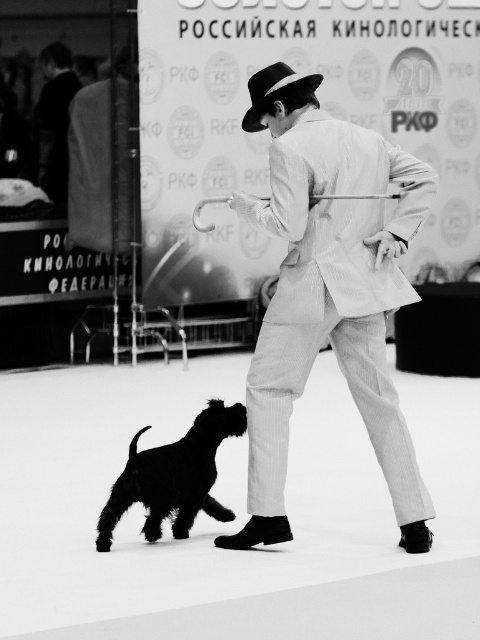
You are a photographer at the event and need to capture a closeup of the white pinstripe suit at center and the black fur dog at lower left. Which subject should you focus on first if you want to ensure both are in sharp focus?

The white pinstripe suit at center is bigger than the black fur dog at lower left, so you should focus on the white pinstripe suit at center first to ensure both are in sharp focus.

In the scene shown: You are a photographer at the dog show and need to position a spotlight exactly at the center of the image. The spotlight has a radius of 0.3 units. Will the white pinstripe suit at center be fully illuminated by the spotlight?

The white pinstripe suit at center is located at point (327, 292). To determine if it is fully illuminated by the spotlight centered at the image center with a radius of 0.3 units, we calculate the distance from the center. If the distance is less than 0.3, it will be fully illuminated. However, without knowing the exact coordinates of the image center, we cannot confirm. The answer depends on the image dimensions and coordinate system used.

You are a photographer at the event and need to adjust your camera settings to focus on both the white pinstripe suit at center and the black felt fedora at center. Since the camera can only focus on one height at a time, which object should you prioritize focusing on based on their height?

The white pinstripe suit at center is taller than the black felt fedora at center, so you should prioritize focusing on the white pinstripe suit at center to ensure proper focus given its greater height.